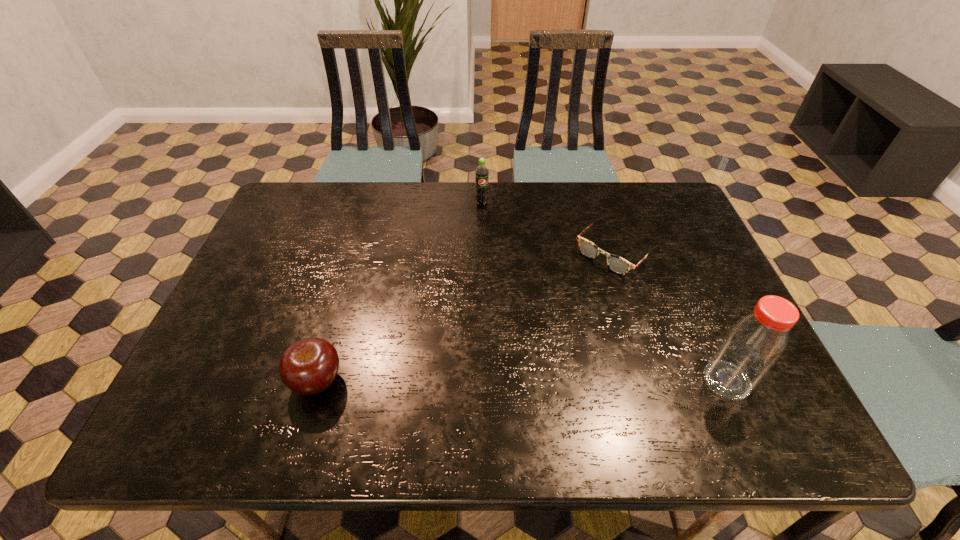
Locate an element on the screen. The height and width of the screenshot is (540, 960). object that stands as the closest to the apple is located at coordinates (617, 264).

At what (x,y) coordinates should I click in order to perform the action: click on blank area in the image that satisfies the following two spatial constraints: 1. on the front side of the shortest object; 2. on the right side of the bottle. Please return your answer as a coordinate pair (x, y). The height and width of the screenshot is (540, 960). Looking at the image, I should click on (655, 380).

You are a GUI agent. You are given a task and a screenshot of the screen. Output one action in this format:
    pyautogui.click(x=<x>, y=<y>)
    Task: Click on the blank area in the image that satisfies the following two spatial constraints: 1. on the front side of the second object from left to right; 2. on the right side of the spectacles
    The width and height of the screenshot is (960, 540).
    Given the screenshot: What is the action you would take?
    pyautogui.click(x=482, y=252)